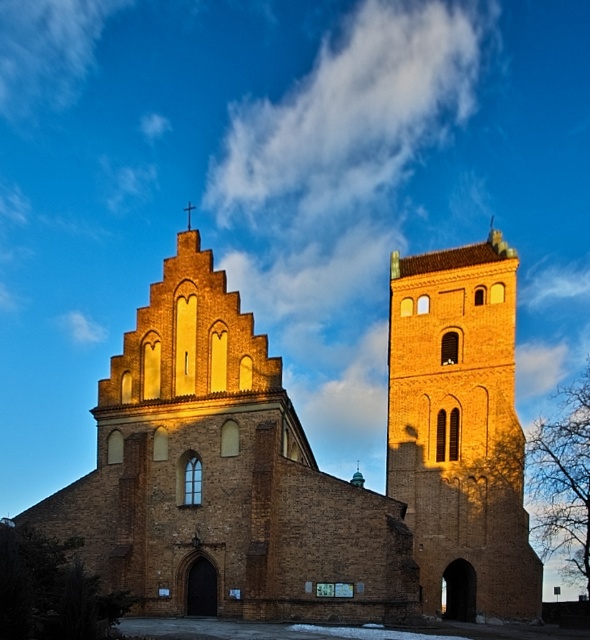
Question: Does brown brick church at center appear on the right side of brown brick tower at center?

Choices:
 (A) no
 (B) yes

Answer: (A)

Question: Which point is closer to the camera?

Choices:
 (A) (440, 506)
 (B) (450, 420)

Answer: (A)

Question: Considering the relative positions of brown brick church at center and brown brick tower at center in the image provided, where is brown brick church at center located with respect to brown brick tower at center?

Choices:
 (A) above
 (B) below

Answer: (B)

Question: From the image, what is the correct spatial relationship of brown brick church at center in relation to brown brick tower at center?

Choices:
 (A) left
 (B) right

Answer: (A)

Question: Which point is closer to the camera taking this photo?

Choices:
 (A) (517, 516)
 (B) (87, 515)

Answer: (B)